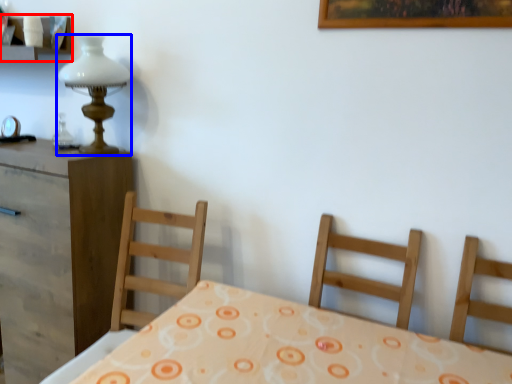
Question: Which point is further to the camera, shelf (highlighted by a red box) or table lamp (highlighted by a blue box)?

Choices:
 (A) shelf
 (B) table lamp

Answer: (A)